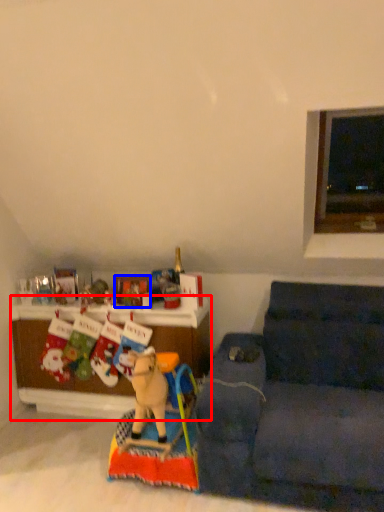
Question: Which of the following is the farthest to the observer, cabinetry (highlighted by a red box) or picture frame (highlighted by a blue box)?

Choices:
 (A) cabinetry
 (B) picture frame

Answer: (B)